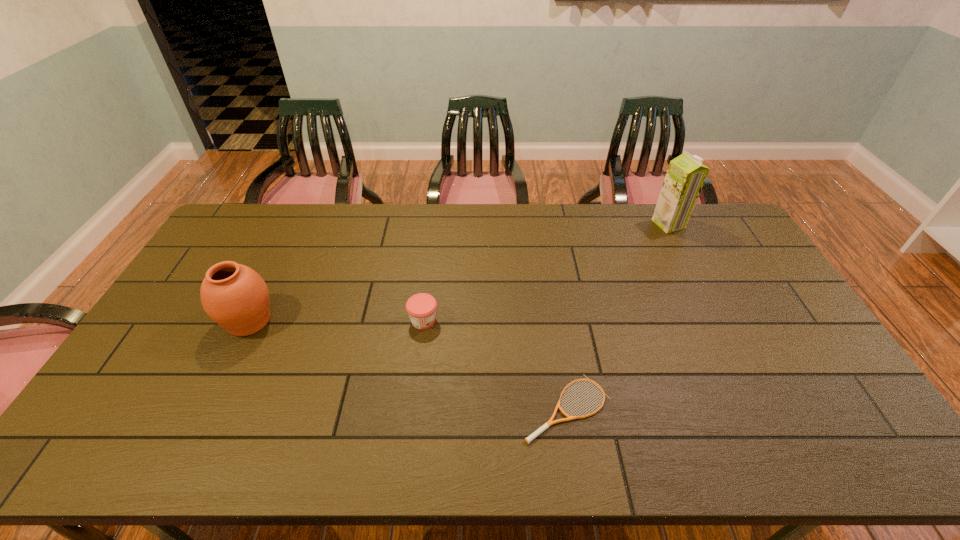
The width and height of the screenshot is (960, 540). I want to click on free region at the near right corner, so click(824, 445).

The image size is (960, 540). In order to click on unoccupied area between the third tallest object and the tennis racket in this screenshot , I will do pyautogui.click(x=495, y=364).

Identify the location of free spot between the second tallest object and the farthest object. (459, 272).

The height and width of the screenshot is (540, 960). I want to click on free space between the urn and the tennis racket, so click(408, 364).

Where is `vacant space that's between the farthest object and the second object from left to right`? vacant space that's between the farthest object and the second object from left to right is located at coordinates (546, 272).

The width and height of the screenshot is (960, 540). I want to click on free spot between the urn and the shortest object, so click(408, 364).

Where is `free space between the second object from left to right and the farthest object`? The height and width of the screenshot is (540, 960). free space between the second object from left to right and the farthest object is located at coordinates (546, 272).

The image size is (960, 540). What are the coordinates of `vacant space that's between the second shortest object and the tallest object` in the screenshot? It's located at (546, 272).

At what (x,y) coordinates should I click in order to perform the action: click on blank region between the jam and the second tallest object. Please return your answer as a coordinate pair (x, y). The height and width of the screenshot is (540, 960). Looking at the image, I should click on (336, 320).

Where is `unoccupied position between the shortest object and the rightmost object`? unoccupied position between the shortest object and the rightmost object is located at coordinates (618, 316).